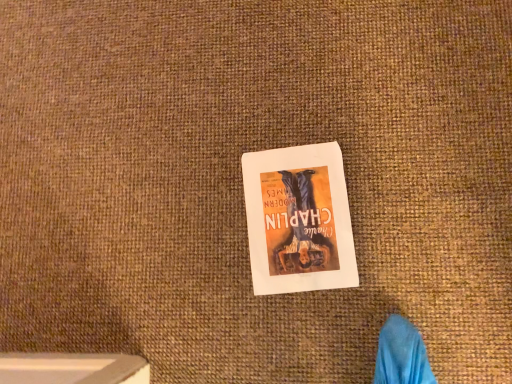
In order to click on vacant area to the left of white paper at center in this screenshot , I will do `click(204, 280)`.